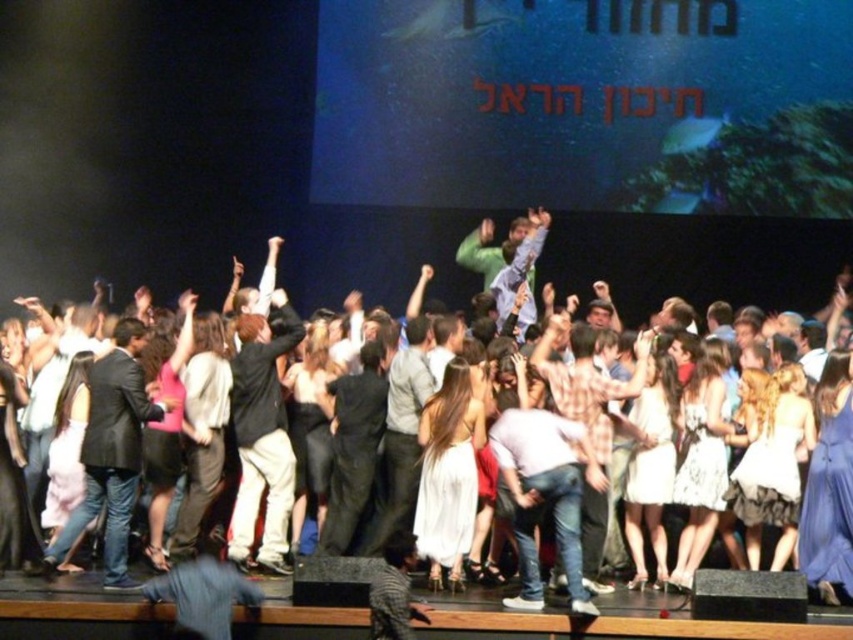
Question: Among these points, which one is nearest to the camera?

Choices:
 (A) (141, 401)
 (B) (549, 390)

Answer: (A)

Question: Is black matte jacket at center bigger than light brown leather jacket at center?

Choices:
 (A) no
 (B) yes

Answer: (B)

Question: Can you confirm if white satin dress at center is bigger than light brown leather jacket at center?

Choices:
 (A) no
 (B) yes

Answer: (A)

Question: Which object is farther from the camera taking this photo?

Choices:
 (A) dark gray suit at center
 (B) light brown leather jacket at center
 (C) black matte jacket at center
 (D) white satin dress at center

Answer: (C)

Question: Is black matte jacket at center smaller than plaid fabric shirt at center?

Choices:
 (A) yes
 (B) no

Answer: (A)

Question: Which of the following is the closest to the observer?

Choices:
 (A) light brown leather jacket at center
 (B) plaid fabric shirt at center

Answer: (B)